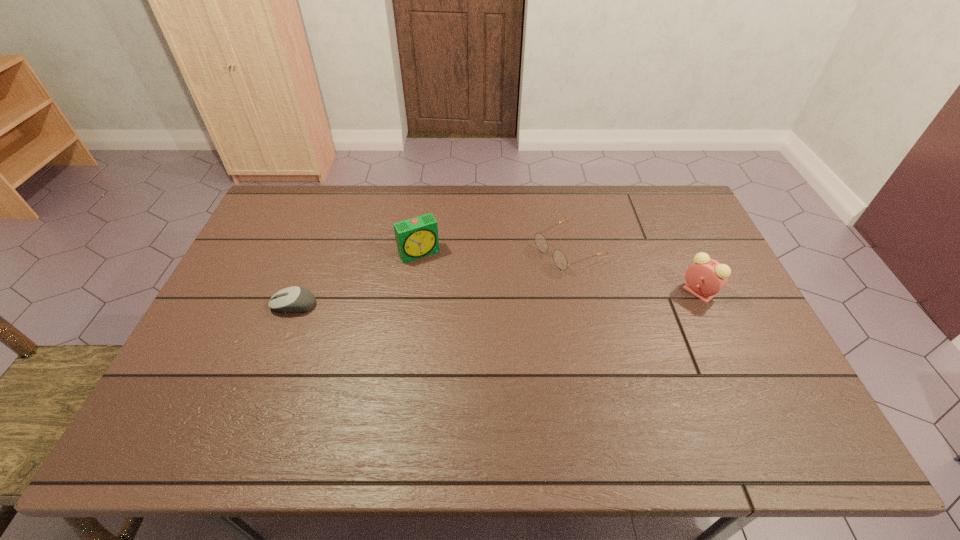
Locate an element on the screen. The width and height of the screenshot is (960, 540). free space on the desktop that is between the leftmost object and the nearer alarm clock and is positioned on the temples of the spectacles is located at coordinates (463, 300).

Image resolution: width=960 pixels, height=540 pixels. In order to click on free space on the desktop that is between the computer equipment and the right alarm clock and is positioned on the front-facing side of the left alarm clock in this screenshot , I will do `click(446, 300)`.